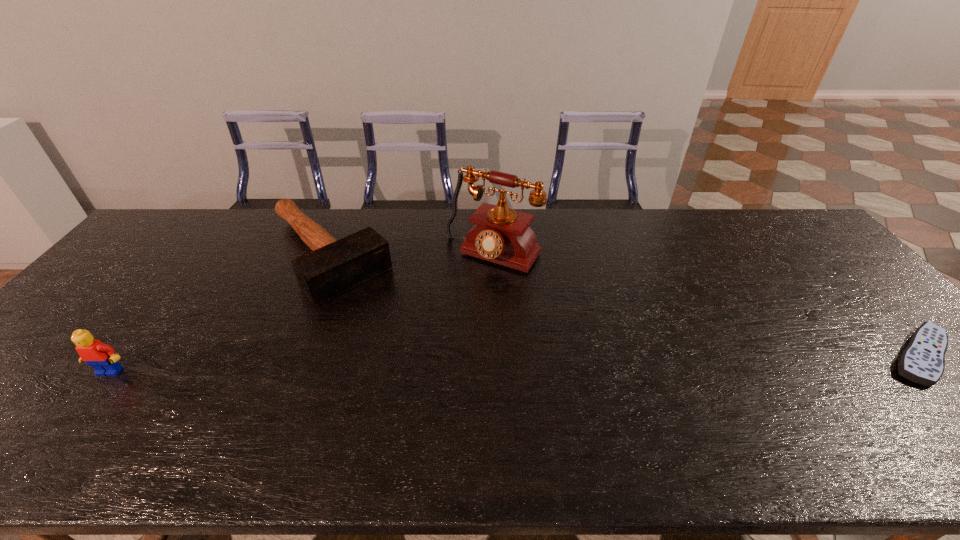
Image resolution: width=960 pixels, height=540 pixels. Find the location of `free spot on the desktop that is between the second tallest object and the rightmost object and is positioned on the dial of the tallest object`. free spot on the desktop that is between the second tallest object and the rightmost object and is positioned on the dial of the tallest object is located at coordinates (410, 365).

Where is `free space on the desktop that is between the Lego and the rightmost object and is positioned on the hammer head face of the second object from left to right`? The image size is (960, 540). free space on the desktop that is between the Lego and the rightmost object and is positioned on the hammer head face of the second object from left to right is located at coordinates (438, 364).